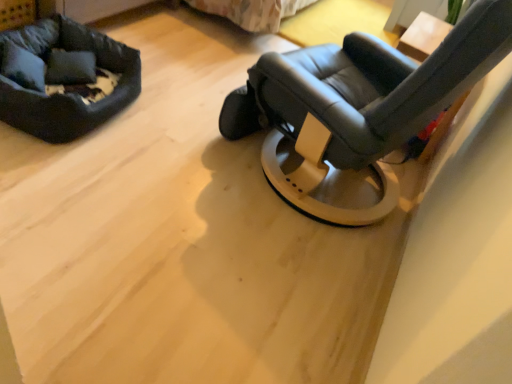
Question: Based on their sizes in the image, would you say wooden table at upper right is bigger or smaller than soft black fabric dog bed at upper left?

Choices:
 (A) big
 (B) small

Answer: (A)

Question: Considering their positions, is wooden table at upper right located in front of or behind soft black fabric dog bed at upper left?

Choices:
 (A) front
 (B) behind

Answer: (B)

Question: Which of these objects is positioned farthest from the matte black chair at center?

Choices:
 (A) soft black fabric dog bed at upper left
 (B) soft gray fabric pillow at upper left
 (C) wooden table at upper right

Answer: (B)

Question: Which of these objects is positioned farthest from the wooden table at upper right?

Choices:
 (A) matte black chair at center
 (B) soft gray fabric pillow at upper left
 (C) soft black fabric dog bed at upper left

Answer: (B)